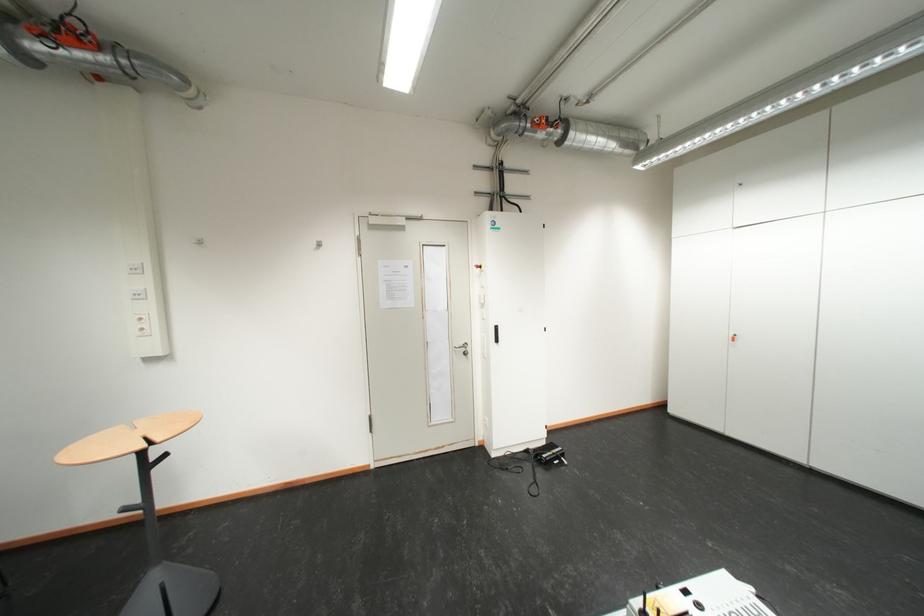
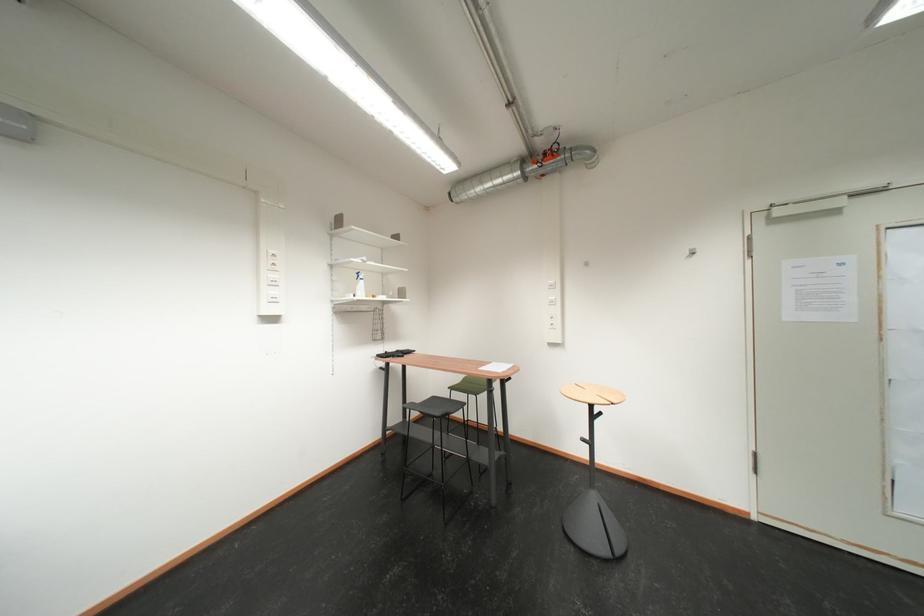
In the second image, find the point that corresponds to (151,336) in the first image.

(562, 329)